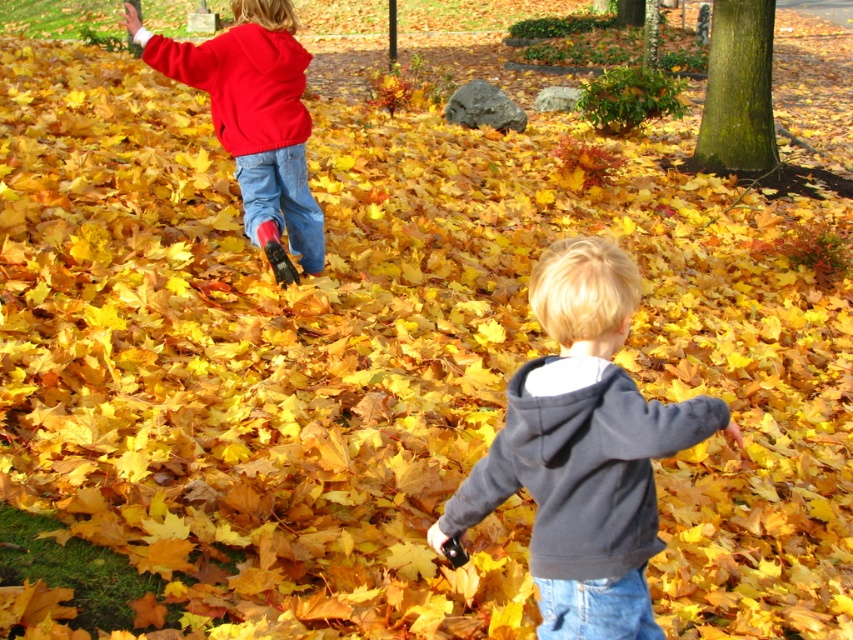
Does matte red hoodie at upper left have a smaller size compared to jeans at left?

Actually, matte red hoodie at upper left might be larger than jeans at left.

Does matte red hoodie at upper left have a lesser height compared to jeans at left?

No.

What do you see at coordinates (254, 115) in the screenshot? I see `matte red hoodie at upper left` at bounding box center [254, 115].

Image resolution: width=853 pixels, height=640 pixels. I want to click on matte red hoodie at upper left, so click(x=254, y=115).

Is point (610, 586) farther from camera compared to point (306, 262)?

No, (610, 586) is closer to viewer.

Image resolution: width=853 pixels, height=640 pixels. Describe the element at coordinates (596, 609) in the screenshot. I see `jeans at lower right` at that location.

I want to click on jeans at lower right, so click(x=596, y=609).

Is matte red hoodie at upper left smaller than jeans at lower right?

Incorrect, matte red hoodie at upper left is not smaller in size than jeans at lower right.

At what (x,y) coordinates should I click in order to perform the action: click on matte red hoodie at upper left. Please return your answer as a coordinate pair (x, y). Looking at the image, I should click on (254, 115).

Find the location of a particular element. The width and height of the screenshot is (853, 640). matte red hoodie at upper left is located at coordinates (254, 115).